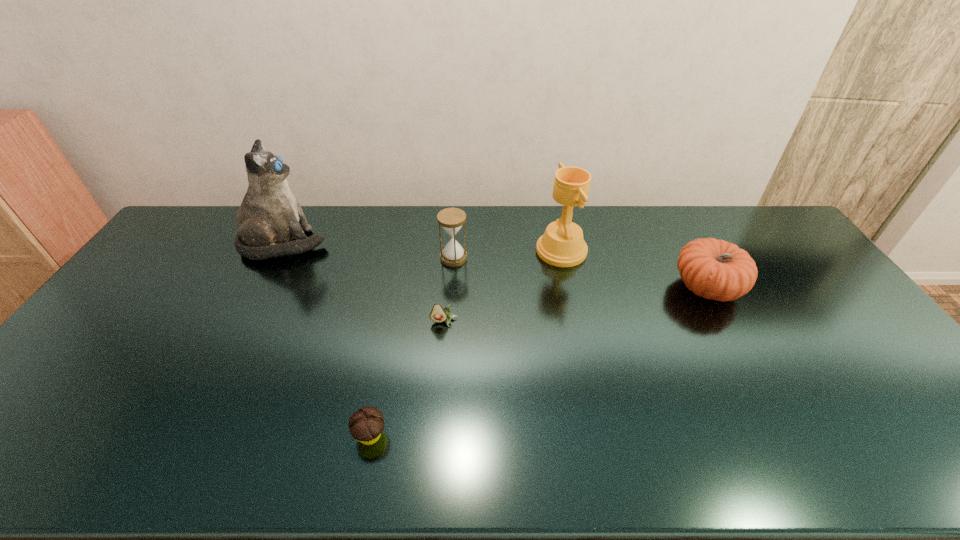
Where is `vacant area that lies between the rightmost object and the hourglass`? This screenshot has width=960, height=540. vacant area that lies between the rightmost object and the hourglass is located at coordinates 580,273.

Where is `free point between the nearest object and the pumpkin`? This screenshot has height=540, width=960. free point between the nearest object and the pumpkin is located at coordinates tap(539, 361).

You are a GUI agent. You are given a task and a screenshot of the screen. Output one action in this format:
    pyautogui.click(x=<x>, y=<y>)
    Task: Click on the empty location between the second nearest object and the nearest object
    The image size is (960, 540).
    Given the screenshot: What is the action you would take?
    click(x=407, y=379)

Image resolution: width=960 pixels, height=540 pixels. Find the location of `free spot between the pumpkin and the award`. free spot between the pumpkin and the award is located at coordinates (634, 269).

Identify the location of object that can be found as the second closest to the fifth object from right to left. (451, 219).

You are a GUI agent. You are given a task and a screenshot of the screen. Output one action in this format:
    pyautogui.click(x=<x>, y=<y>)
    Task: Click on the object that is the third closest to the second object from left to right
    This screenshot has width=960, height=540.
    Given the screenshot: What is the action you would take?
    pyautogui.click(x=269, y=217)

Locate an element on the screen. The image size is (960, 540). vacant position in the image that satisfies the following two spatial constraints: 1. on the back side of the hourglass; 2. at the face of the cat is located at coordinates (455, 244).

Identify the location of free space that satisfies the following two spatial constraints: 1. on the back side of the hourglass; 2. at the face of the tallest object. This screenshot has height=540, width=960. (455, 244).

Locate an element on the screen. The height and width of the screenshot is (540, 960). vacant area that satisfies the following two spatial constraints: 1. on the back side of the second tallest object; 2. at the face of the leftmost object is located at coordinates (560, 244).